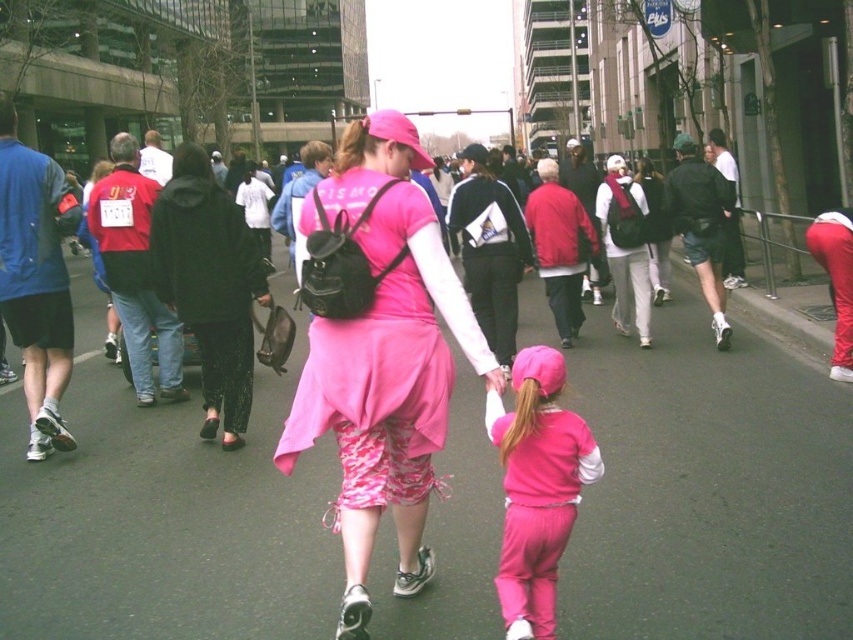
Does point (350, 374) come closer to viewer compared to point (552, 435)?

No, (350, 374) is behind (552, 435).

Image resolution: width=853 pixels, height=640 pixels. I want to click on matte pink dress at center, so click(381, 353).